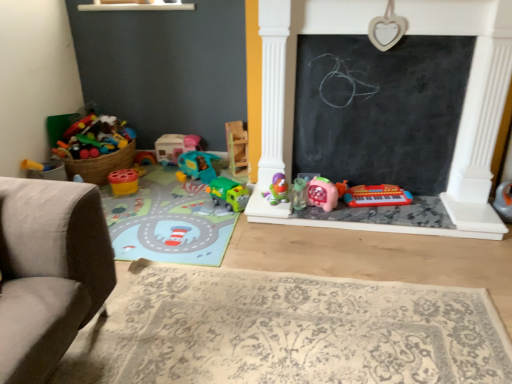
The image size is (512, 384). In order to click on free location above beige textured rug at lower center, the 1th mat positioned from the front (from a real-world perspective) in this screenshot , I will do `click(283, 330)`.